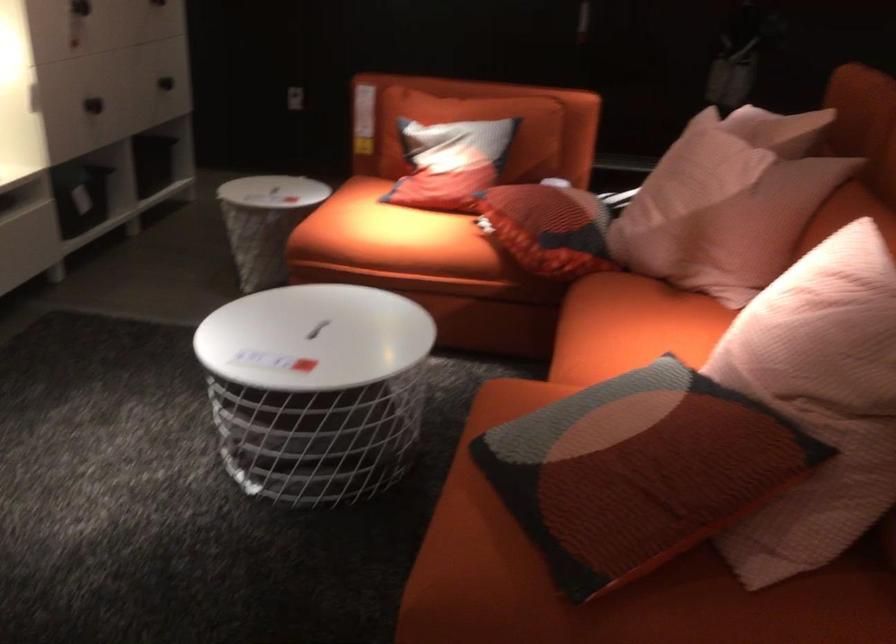
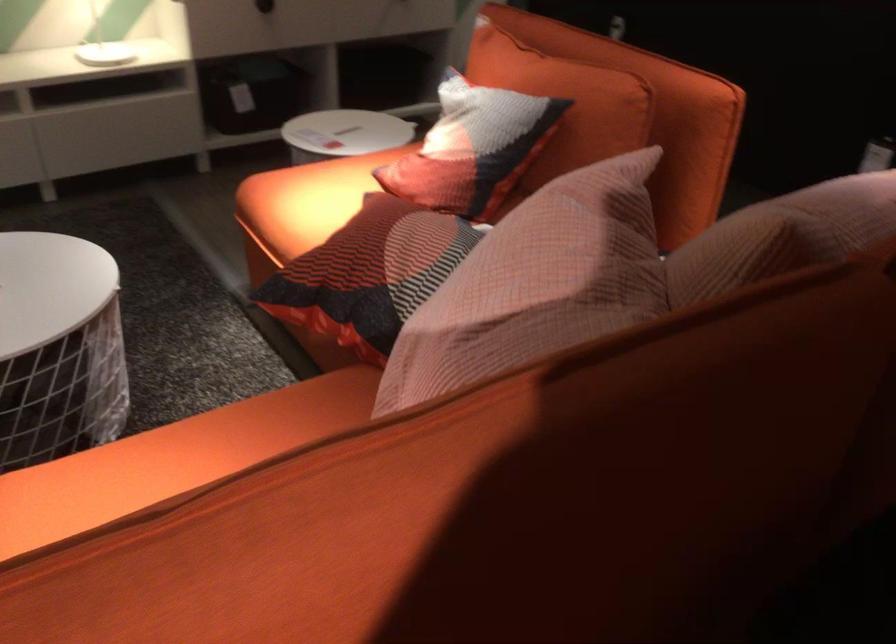
Locate, in the second image, the point that corresponds to [486,156] in the first image.

(472, 147)